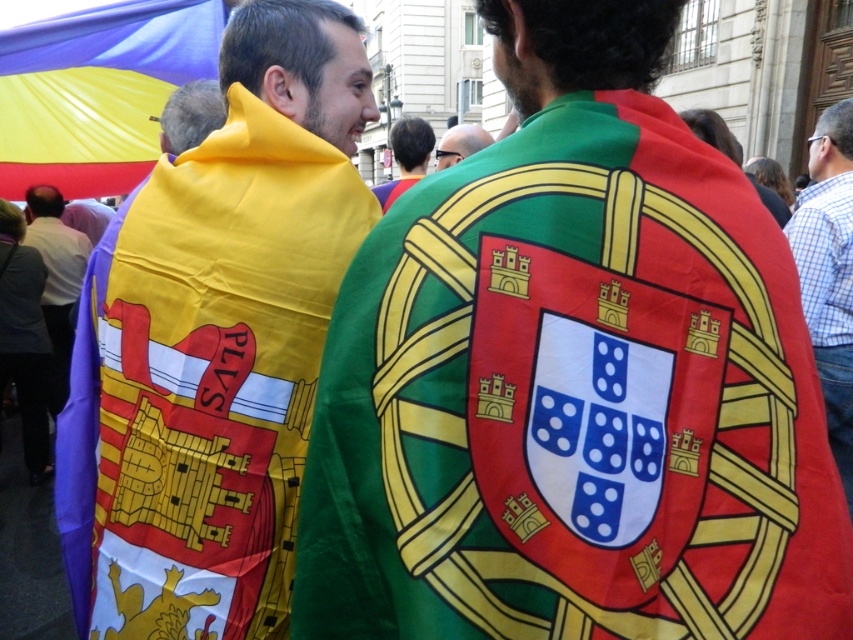
How far apart are blue checkered shirt at right and green fabric headscarf at center?

blue checkered shirt at right and green fabric headscarf at center are 25.23 feet apart.

Can you confirm if blue checkered shirt at right is smaller than green fabric headscarf at center?

Correct, blue checkered shirt at right occupies less space than green fabric headscarf at center.

Is point (836, 122) behind point (410, 132)?

No.

The image size is (853, 640). In order to click on blue checkered shirt at right in this screenshot , I will do `click(828, 273)`.

Measure the distance between blue fabric flag at upper left and matte black shirt at center.

blue fabric flag at upper left and matte black shirt at center are 19.32 feet apart.

Does blue fabric flag at upper left have a lesser width compared to matte black shirt at center?

No.

Is point (177, 28) positioned behind point (68, 278)?

No, it is not.

At what (x,y) coordinates should I click in order to perform the action: click on blue fabric flag at upper left. Please return your answer as a coordinate pair (x, y). Looking at the image, I should click on (122, 38).

The image size is (853, 640). What do you see at coordinates (573, 380) in the screenshot?
I see `polyester flag at center` at bounding box center [573, 380].

Does polyester flag at center have a greater height compared to matte yellow scarf at left?

Incorrect, polyester flag at center's height is not larger of matte yellow scarf at left's.

Is point (693, 618) farther from camera compared to point (265, 500)?

No, it is not.

This screenshot has width=853, height=640. In order to click on polyester flag at center in this screenshot , I will do 573,380.